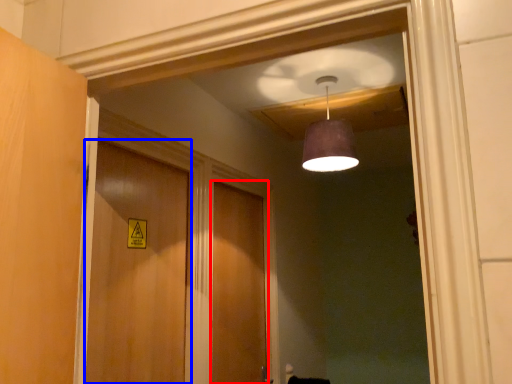
Question: Which object appears closest to the camera in this image, door (highlighted by a red box) or door (highlighted by a blue box)?

Choices:
 (A) door
 (B) door

Answer: (B)